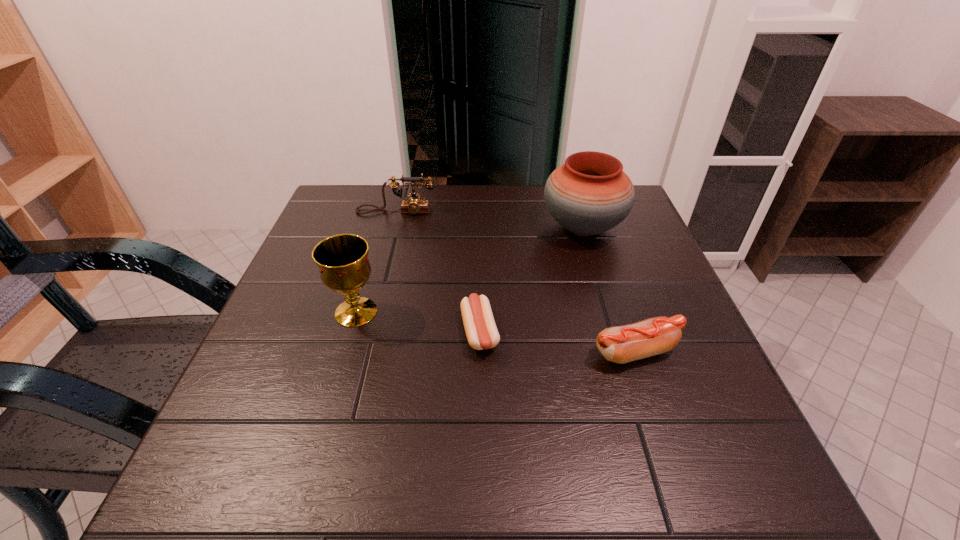
Where is `vacant space at the far edge of the desktop`? vacant space at the far edge of the desktop is located at coordinates (x=530, y=202).

Locate an element on the screen. vacant space at the near edge is located at coordinates (574, 462).

This screenshot has height=540, width=960. Find the location of `vacant point at the left edge`. vacant point at the left edge is located at coordinates (318, 289).

Locate an element on the screen. The image size is (960, 540). free space at the right edge is located at coordinates (616, 244).

In the image, there is a desktop. Identify the location of vacant space at the far left corner. (365, 219).

The width and height of the screenshot is (960, 540). In the image, there is a desktop. Identify the location of blank space at the near left corner. (250, 492).

At what (x,y) coordinates should I click in order to perform the action: click on empty space that is in between the chalice and the left sausage. Please return your answer as a coordinate pair (x, y). The image size is (960, 540). Looking at the image, I should click on tap(418, 322).

Locate an element on the screen. Image resolution: width=960 pixels, height=540 pixels. free spot between the chalice and the left sausage is located at coordinates (418, 322).

Locate an element on the screen. This screenshot has height=540, width=960. free area in between the taller sausage and the telephone is located at coordinates (516, 282).

Find the location of a particular element. unoccupied position between the shortest object and the chalice is located at coordinates (418, 322).